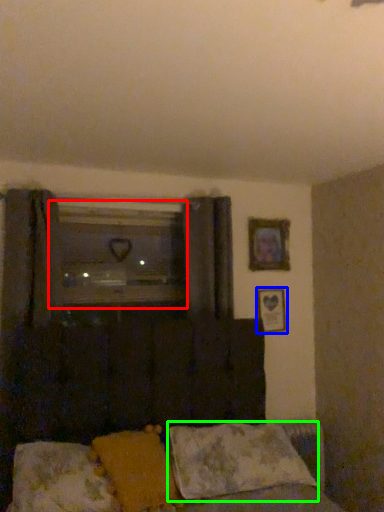
Question: Considering the real-world distances, which object is closest to window (highlighted by a red box)? picture frame (highlighted by a blue box) or pillow (highlighted by a green box).

Choices:
 (A) picture frame
 (B) pillow

Answer: (A)